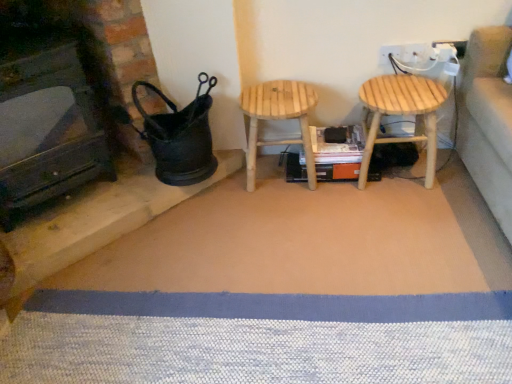
Question: From a real-world perspective, does natural wood stool at center, marked as the 1th stool in a left-to-right arrangement, stand above black matte fireplace at left?

Choices:
 (A) yes
 (B) no

Answer: (B)

Question: Is natural wood stool at center, which is counted as the 2th stool, starting from the right, at the left side of black matte fireplace at left?

Choices:
 (A) no
 (B) yes

Answer: (A)

Question: Can we say natural wood stool at center, which is counted as the 2th stool, starting from the right, lies outside black matte fireplace at left?

Choices:
 (A) yes
 (B) no

Answer: (A)

Question: Are natural wood stool at center, marked as the 1th stool in a left-to-right arrangement, and black matte fireplace at left beside each other?

Choices:
 (A) no
 (B) yes

Answer: (A)

Question: In the image, is natural wood stool at center, marked as the 1th stool in a left-to-right arrangement, on the left side or the right side of natural wood stool at right, arranged as the second stool when viewed from the left?

Choices:
 (A) left
 (B) right

Answer: (A)

Question: Is natural wood stool at center, which is counted as the 2th stool, starting from the right, wider or thinner than natural wood stool at right, arranged as the second stool when viewed from the left?

Choices:
 (A) thin
 (B) wide

Answer: (B)

Question: Is natural wood stool at center, marked as the 1th stool in a left-to-right arrangement, in front of or behind natural wood stool at right, arranged as the second stool when viewed from the left, in the image?

Choices:
 (A) behind
 (B) front

Answer: (A)

Question: From a real-world perspective, is natural wood stool at center, marked as the 1th stool in a left-to-right arrangement, above or below natural wood stool at right, arranged as the second stool when viewed from the left?

Choices:
 (A) below
 (B) above

Answer: (A)

Question: Considering the positions of natural wood stool at center, which is counted as the 2th stool, starting from the right, and black matte fireplace at left in the image, is natural wood stool at center, which is counted as the 2th stool, starting from the right, bigger or smaller than black matte fireplace at left?

Choices:
 (A) small
 (B) big

Answer: (A)

Question: Would you say natural wood stool at center, which is counted as the 2th stool, starting from the right, is inside or outside black matte fireplace at left?

Choices:
 (A) inside
 (B) outside

Answer: (B)

Question: Relative to black matte fireplace at left, is natural wood stool at center, marked as the 1th stool in a left-to-right arrangement, in front or behind?

Choices:
 (A) front
 (B) behind

Answer: (B)

Question: Is point (246, 183) closer or farther from the camera than point (70, 109)?

Choices:
 (A) farther
 (B) closer

Answer: (A)

Question: Is black matte fireplace at left bigger or smaller than natural wood stool at center, which is counted as the 2th stool, starting from the right?

Choices:
 (A) small
 (B) big

Answer: (B)

Question: In the image, is black matte fireplace at left positioned in front of or behind natural wood stool at center, which is counted as the 2th stool, starting from the right?

Choices:
 (A) behind
 (B) front

Answer: (B)